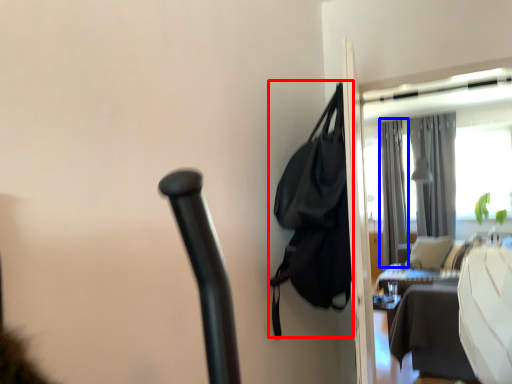
Question: Which object is closer to the camera taking this photo, bag (highlighted by a red box) or curtain (highlighted by a blue box)?

Choices:
 (A) bag
 (B) curtain

Answer: (A)